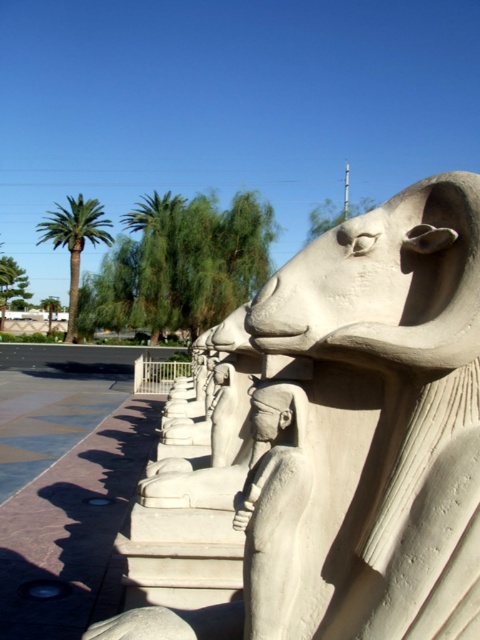
Question: From the image, what is the correct spatial relationship of white stone sphinx at center in relation to green leafy palm at left?

Choices:
 (A) above
 (B) below

Answer: (B)

Question: Is white stone sphinx at center smaller than green leafy palm at left?

Choices:
 (A) no
 (B) yes

Answer: (B)

Question: Can you confirm if white stone sphinx at center is smaller than green leafy palm at left?

Choices:
 (A) yes
 (B) no

Answer: (A)

Question: Based on their relative distances, which object is farther from the green leafy palm at left?

Choices:
 (A) white stone sphinx at center
 (B) green leafy palm tree at upper center

Answer: (A)

Question: Among these objects, which one is nearest to the camera?

Choices:
 (A) green leafy palm tree at upper center
 (B) white stone sphinx at center

Answer: (B)

Question: Which of the following is the closest to the observer?

Choices:
 (A) white stone sphinx at center
 (B) green leafy palm tree at upper center

Answer: (A)